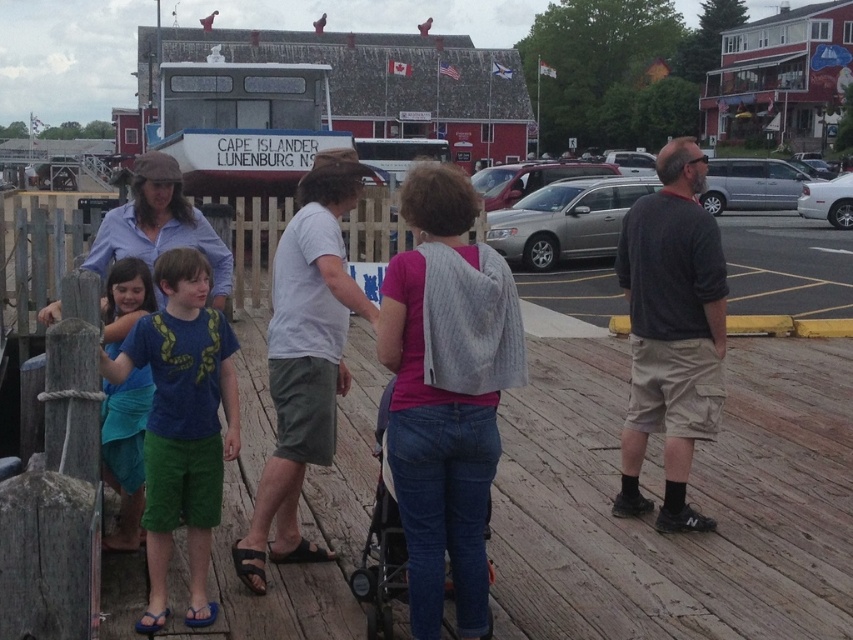
You are a photographer trying to capture a group photo of the dark gray cotton shirt at center and the blue fabric shirt at left. You need to ensure both subjects are fully visible in the frame. Which subject should you position closer to the camera to avoid cropping either of them?

You should position the blue fabric shirt at left closer to the camera because the dark gray cotton shirt at center might be wider than the blue fabric shirt at left, so moving the narrower subject forward ensures both fit within the frame.